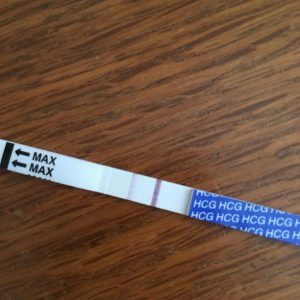
Locate an element on the screen. wooden desk is located at coordinates (92, 257).